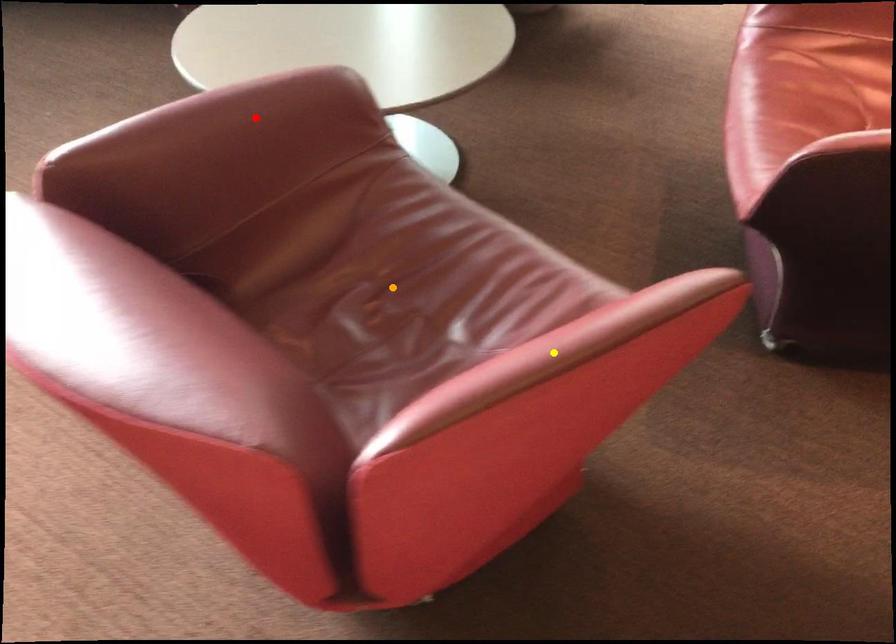
Order these from nearest to farthest:
orange point, yellow point, red point

1. yellow point
2. orange point
3. red point